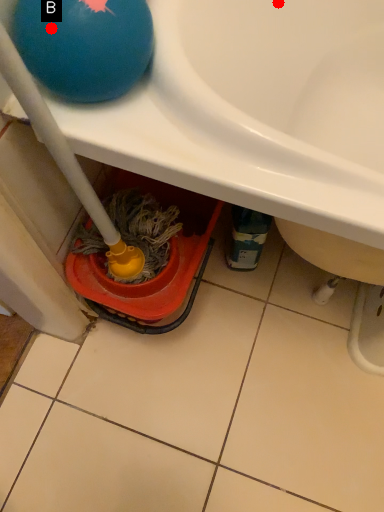
Question: Two points are circled on the image, labeled by A and B beside each circle. Which point is further to the camera?

Choices:
 (A) A is further
 (B) B is further

Answer: (A)